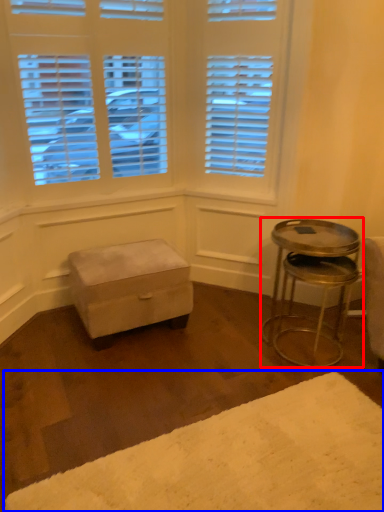
Question: Among these objects, which one is farthest to the camera, table (highlighted by a red box) or plain (highlighted by a blue box)?

Choices:
 (A) table
 (B) plain

Answer: (A)